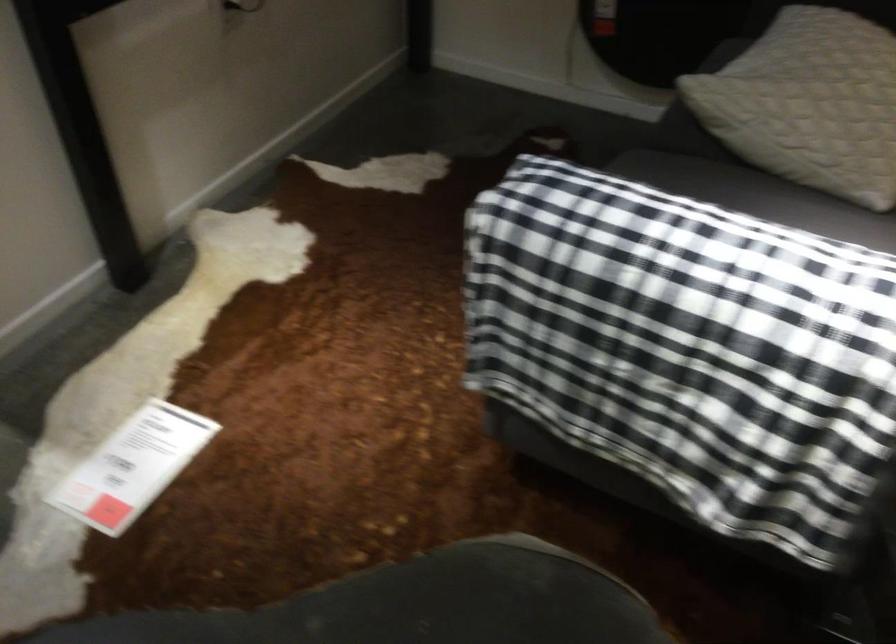
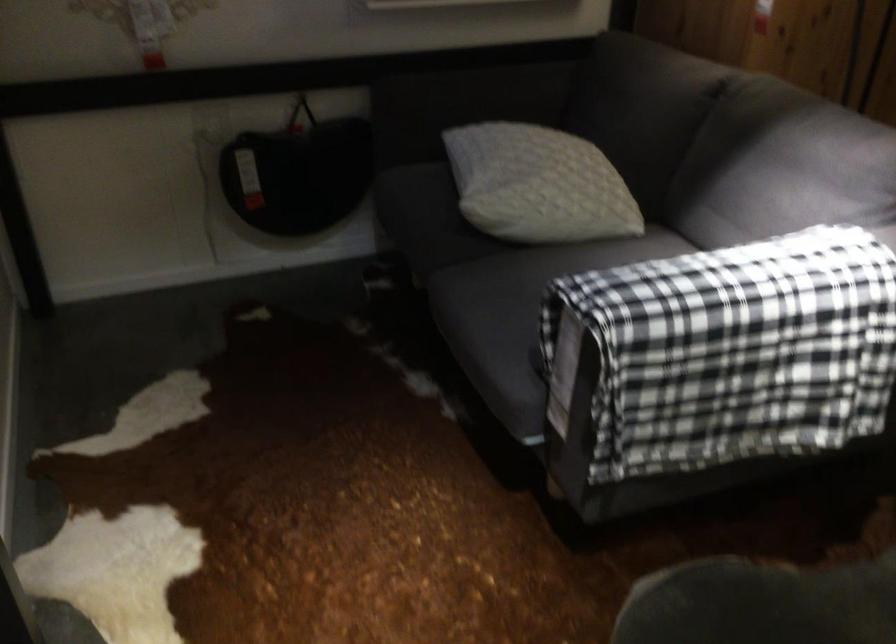
Locate, in the second image, the point that corresponds to point 787,88 in the first image.

(538, 185)